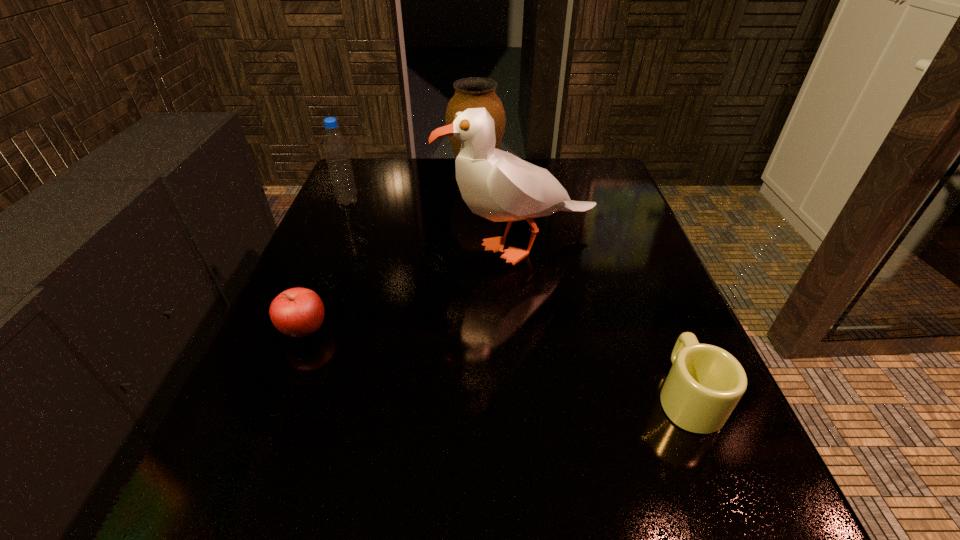
What are the coordinates of `gull present at the right edge` in the screenshot? It's located at (497, 185).

Where is `mug that is at the right edge`? This screenshot has height=540, width=960. mug that is at the right edge is located at coordinates (x=705, y=383).

Where is `object located in the far left corner section of the desktop`? This screenshot has height=540, width=960. object located in the far left corner section of the desktop is located at coordinates (335, 147).

The height and width of the screenshot is (540, 960). What are the coordinates of `free region at the far edge of the desktop` in the screenshot? It's located at (412, 190).

The height and width of the screenshot is (540, 960). In order to click on blank space at the near edge in this screenshot , I will do `click(443, 488)`.

Image resolution: width=960 pixels, height=540 pixels. Find the location of `free space at the left edge of the desktop`. free space at the left edge of the desktop is located at coordinates (367, 202).

In the image, there is a desktop. Where is `vacant space at the right edge`? This screenshot has width=960, height=540. vacant space at the right edge is located at coordinates (659, 267).

In the image, there is a desktop. What are the coordinates of `free space at the far left corner` in the screenshot? It's located at (380, 186).

Identify the location of vacant space at the far right corner of the desktop. The height and width of the screenshot is (540, 960). (574, 161).

At what (x,y) coordinates should I click in order to perform the action: click on vacant area that lies between the fourth nearest object and the rightmost object. Please return your answer as a coordinate pair (x, y). Image resolution: width=960 pixels, height=540 pixels. Looking at the image, I should click on (517, 299).